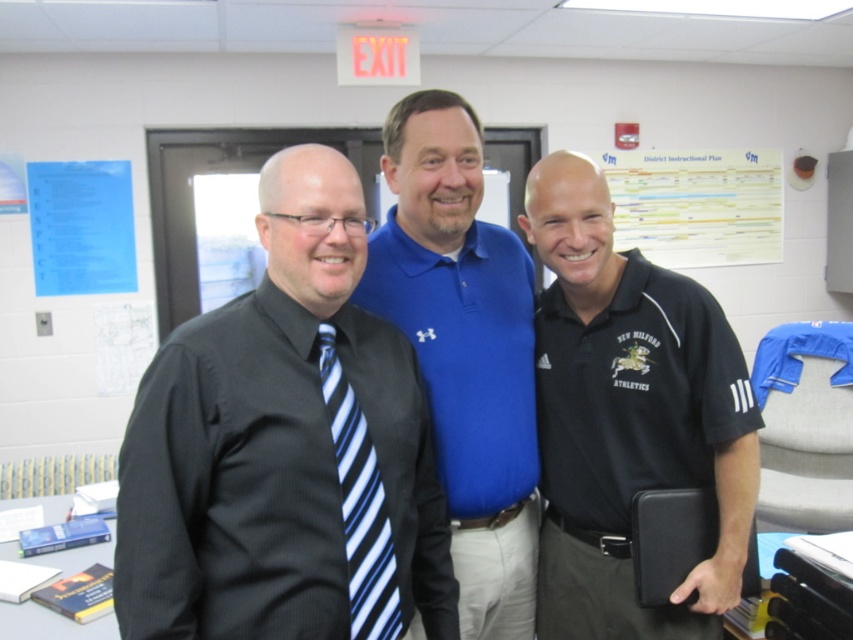
You are an office worker who needs to file a document. You see the white paper at upper center and the blue striped tie at left. Which object is closer to the right side of the scene?

The white paper at upper center is positioned on the right side of the blue striped tie at left, so the white paper at upper center is closer to the right side of the scene.

You are a photographer setting up a shoot in an office. You notice the blue cotton polo shirt at center and the white paper at upper center. Which object is closer to the camera?

The blue cotton polo shirt at center is in front of the white paper at upper center, so it is closer to the camera.

You are an office worker who needs to locate the blue cotton polo shirt at center and the white paper at upper center in the image. Which object is positioned to the left of the other?

The blue cotton polo shirt at center is to the left of white paper at upper center.